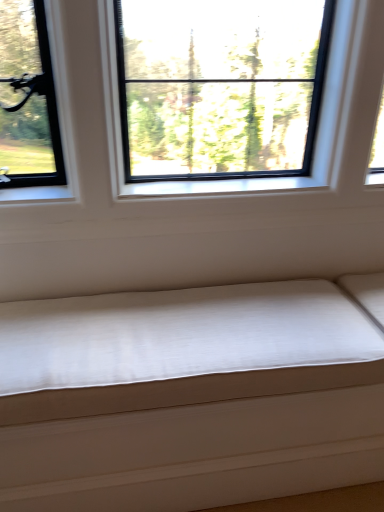
At what (x,y) coordinates should I click in order to perform the action: click on white fabric studio couch at center. Please return your answer as a coordinate pair (x, y). Looking at the image, I should click on (189, 396).

What do you see at coordinates (189, 396) in the screenshot?
I see `white fabric studio couch at center` at bounding box center [189, 396].

Find the location of a particular element. The width and height of the screenshot is (384, 512). white fabric studio couch at center is located at coordinates (189, 396).